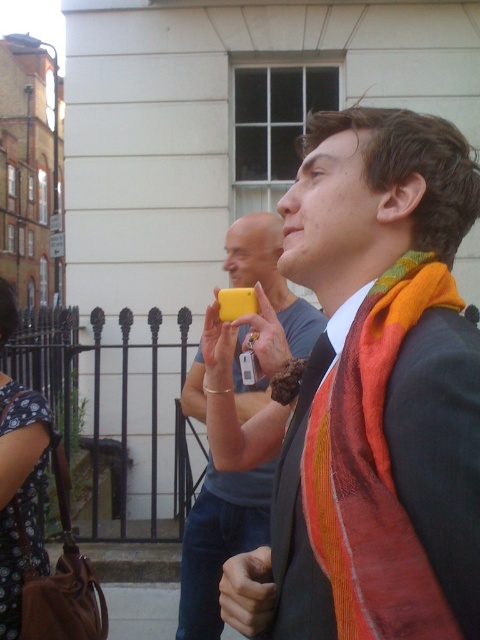
Is point (399, 522) farther from viewer compared to point (205, 403)?

No, it is not.

Between multicolored woven scarf at right and yellow matte phone at center, which one appears on the left side from the viewer's perspective?

Positioned to the left is yellow matte phone at center.

Locate an element on the screen. multicolored woven scarf at right is located at coordinates (372, 468).

Is yellow matte phone at center further to camera compared to dark floral dress at lower left?

Yes, yellow matte phone at center is behind dark floral dress at lower left.

Does yellow matte phone at center have a greater height compared to dark floral dress at lower left?

Yes.

This screenshot has height=640, width=480. Describe the element at coordinates (219, 541) in the screenshot. I see `yellow matte phone at center` at that location.

Image resolution: width=480 pixels, height=640 pixels. In order to click on yellow matte phone at center in this screenshot , I will do `click(219, 541)`.

Can you confirm if multicolored woven scarf at right is shorter than dark floral dress at lower left?

Yes.

Does multicolored woven scarf at right appear on the right side of dark floral dress at lower left?

Correct, you'll find multicolored woven scarf at right to the right of dark floral dress at lower left.

Describe the element at coordinates (372, 468) in the screenshot. I see `multicolored woven scarf at right` at that location.

Find the location of `multicolored woven scarf at right`. multicolored woven scarf at right is located at coordinates (372, 468).